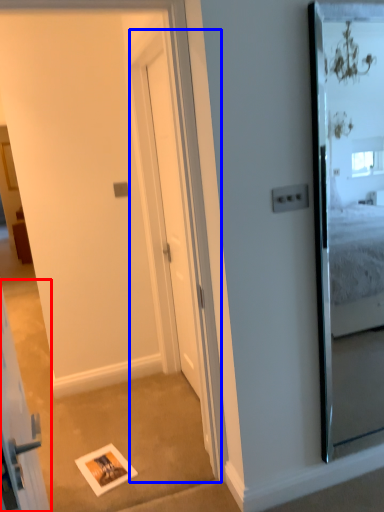
Question: Which object is closer to the camera taking this photo, elevator (highlighted by a red box) or screen door (highlighted by a blue box)?

Choices:
 (A) elevator
 (B) screen door

Answer: (A)